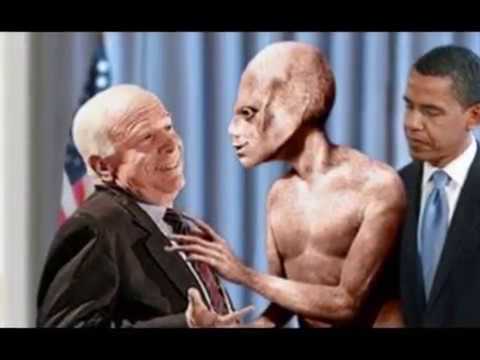
Locate an element on the screen. curtain is located at coordinates (232, 181).